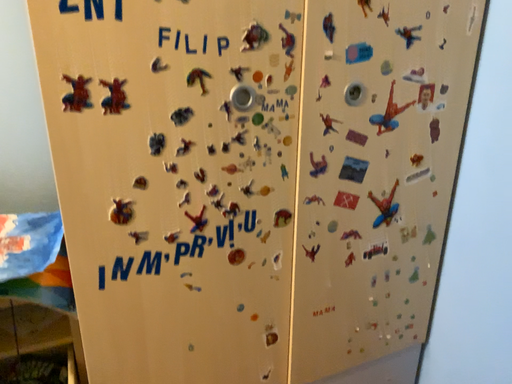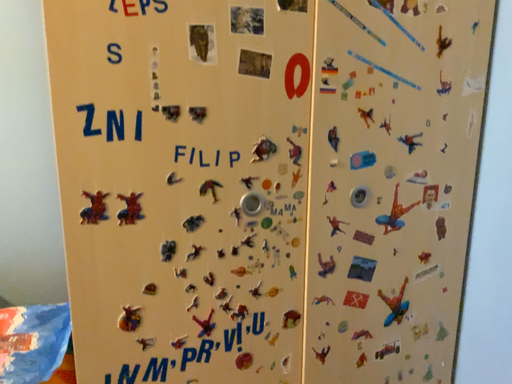
Question: Which way did the camera rotate in the video?

Choices:
 (A) rotated downward
 (B) rotated upward

Answer: (B)